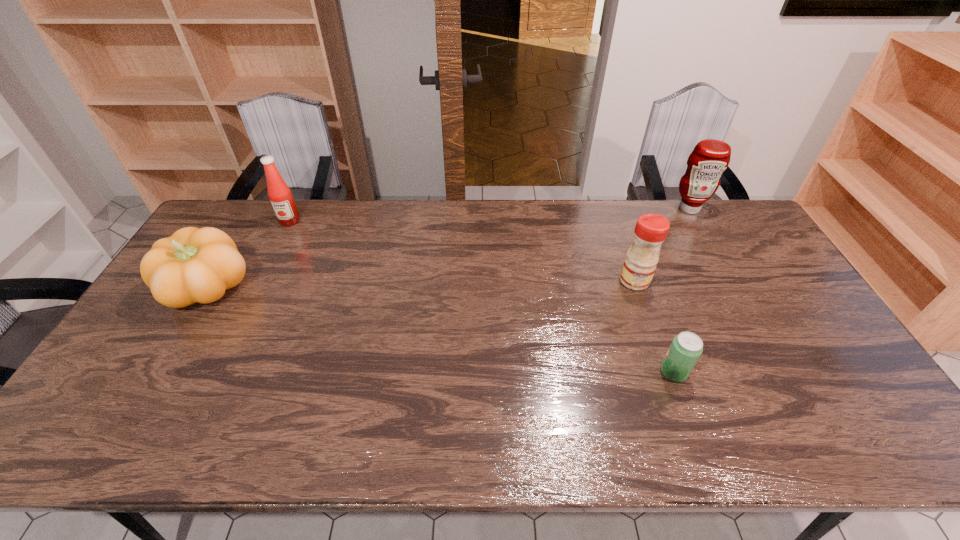
The height and width of the screenshot is (540, 960). In order to click on vacant space located on the right of the shortest object in this screenshot , I will do `click(804, 372)`.

Image resolution: width=960 pixels, height=540 pixels. What are the coordinates of `object positioned at the left edge` in the screenshot? It's located at (193, 265).

You are a GUI agent. You are given a task and a screenshot of the screen. Output one action in this format:
    pyautogui.click(x=<x>, y=<y>)
    Task: Click on the object located in the right edge section of the desktop
    
    Given the screenshot: What is the action you would take?
    pyautogui.click(x=706, y=163)

Identify the location of object located in the far right corner section of the desktop. The image size is (960, 540). (706, 163).

You are a GUI agent. You are given a task and a screenshot of the screen. Output one action in this format:
    pyautogui.click(x=<x>, y=<y>)
    Task: Click on the vacant space at the far edge of the desktop
    Image resolution: width=960 pixels, height=540 pixels.
    Given the screenshot: What is the action you would take?
    pyautogui.click(x=672, y=236)

What are the coordinates of `vacant area at the near edge of the desktop` in the screenshot? It's located at (429, 427).

The height and width of the screenshot is (540, 960). In the image, there is a desktop. In order to click on vacant space at the left edge in this screenshot , I will do `click(142, 410)`.

This screenshot has height=540, width=960. What are the coordinates of `vacant area at the right edge` in the screenshot? It's located at (857, 413).

Locate an element on the screen. The height and width of the screenshot is (540, 960). blank region between the nearest object and the second shortest object is located at coordinates (441, 330).

The image size is (960, 540). Identify the location of free spot between the shortest object and the second condiment from right to left. (654, 326).